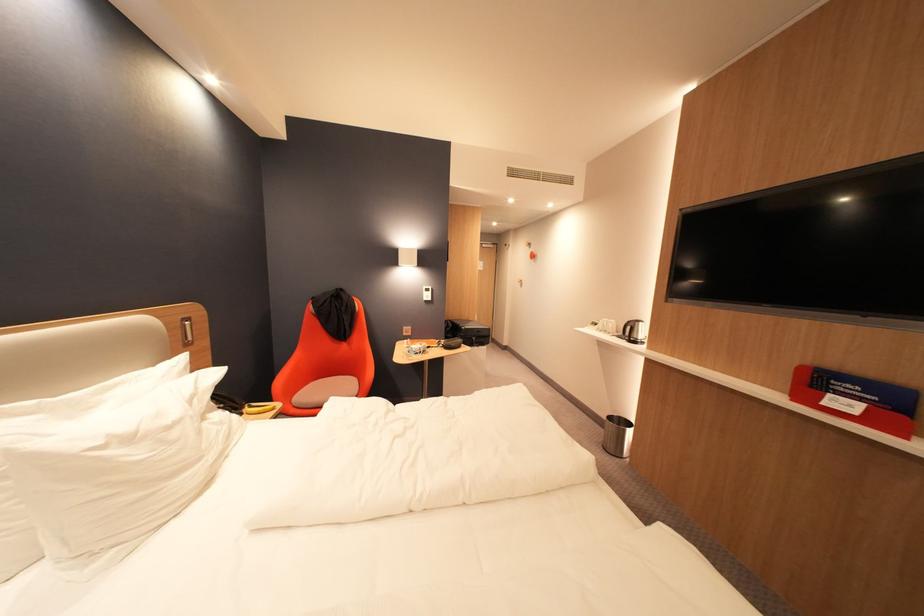
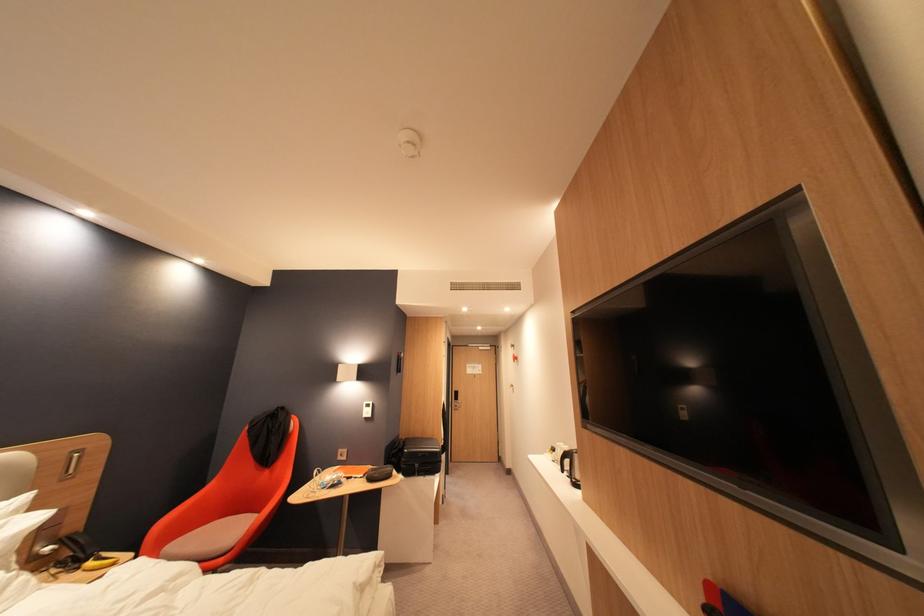
In the second image, find the point that corresponds to (446,347) in the first image.

(371, 477)